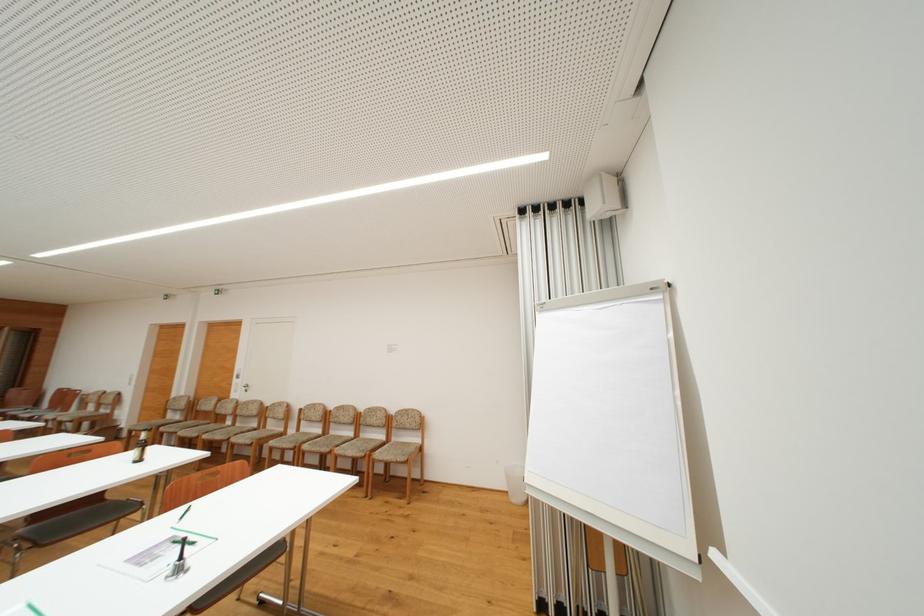
Find where to plac the white wastebasket. Please return your answer as a coordinate pair (x, y).

(515, 484)